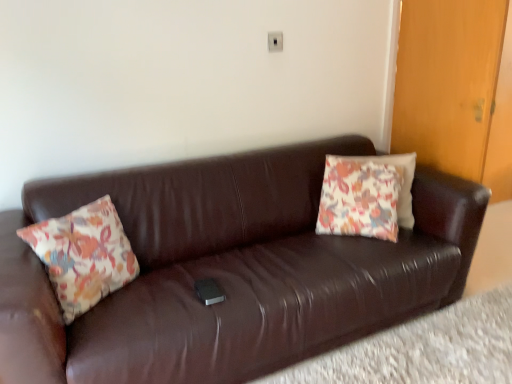
Question: From a real-world perspective, is brown leather couch at lower center above or below floral fabric pillow at left, the second pillow from the right?

Choices:
 (A) below
 (B) above

Answer: (A)

Question: Is brown leather couch at lower center in front of or behind floral fabric pillow at left, which is counted as the 2th pillow, starting from the back, in the image?

Choices:
 (A) front
 (B) behind

Answer: (A)

Question: Estimate the real-world distances between objects in this image. Which object is farther from the brown leather couch at center?

Choices:
 (A) floral fabric pillow at left, arranged as the 1th pillow when viewed from the front
 (B) floral fabric pillow at center, marked as the first pillow in a back-to-front arrangement
 (C) brown leather couch at lower center
 (D) wooden door at right
 (E) white plastic electric outlet at upper center

Answer: (E)

Question: Which is nearer to the brown leather couch at lower center?

Choices:
 (A) floral fabric pillow at left, the second pillow from the right
 (B) wooden door at right
 (C) white plastic electric outlet at upper center
 (D) floral fabric pillow at center, which ranks as the first pillow in right-to-left order
 (E) brown leather couch at center

Answer: (E)